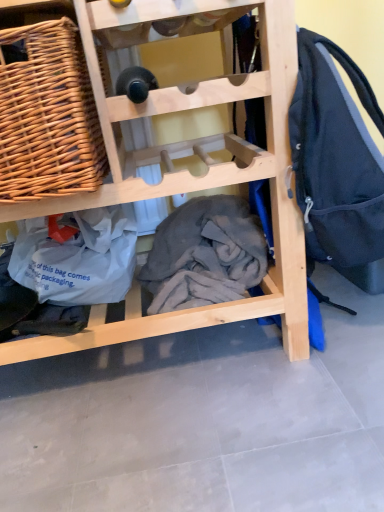
Question: From the image's perspective, is gray cotton blanket at center located above or below woven wood picnic basket at upper left?

Choices:
 (A) above
 (B) below

Answer: (B)

Question: Does point (203, 301) appear closer or farther from the camera than point (3, 112)?

Choices:
 (A) farther
 (B) closer

Answer: (A)

Question: Estimate the real-world distances between objects in this image. Which object is farther from the gray cotton blanket at center?

Choices:
 (A) woven wood picnic basket at upper left
 (B) natural wood wine rack at center

Answer: (A)

Question: Estimate the real-world distances between objects in this image. Which object is farther from the woven wood picnic basket at upper left?

Choices:
 (A) gray cotton blanket at center
 (B) natural wood wine rack at center

Answer: (A)